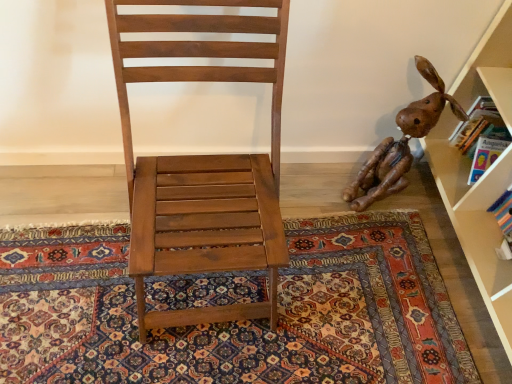
You are a GUI agent. You are given a task and a screenshot of the screen. Output one action in this format:
    pyautogui.click(x=<x>, y=<y>)
    Task: Click on the vacant area to the right of matte wood chair at center
    The image size is (512, 384).
    Given the screenshot: What is the action you would take?
    pyautogui.click(x=340, y=311)